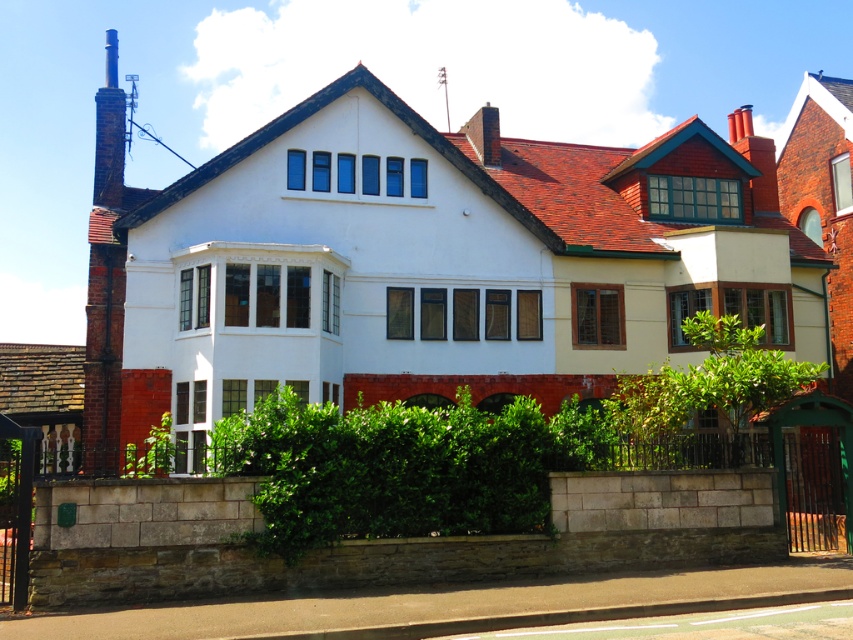
Question: Does green leafy hedge at center have a larger size compared to rusty brick chimney at left?

Choices:
 (A) no
 (B) yes

Answer: (A)

Question: Does green leafy hedge at center appear on the right side of rusty brick chimney at left?

Choices:
 (A) no
 (B) yes

Answer: (B)

Question: Which point appears farthest from the camera in this image?

Choices:
 (A) (97, 292)
 (B) (508, 499)

Answer: (A)

Question: From the image, what is the correct spatial relationship of green leafy hedge at center in relation to rusty brick chimney at left?

Choices:
 (A) left
 (B) right

Answer: (B)

Question: Which object appears farthest from the camera in this image?

Choices:
 (A) green leafy hedge at center
 (B) rusty brick chimney at left

Answer: (B)